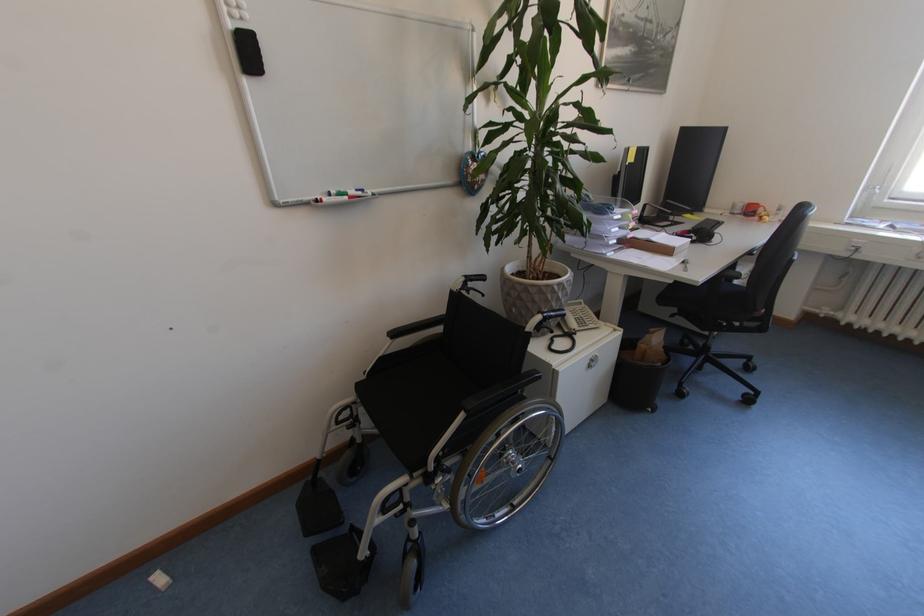
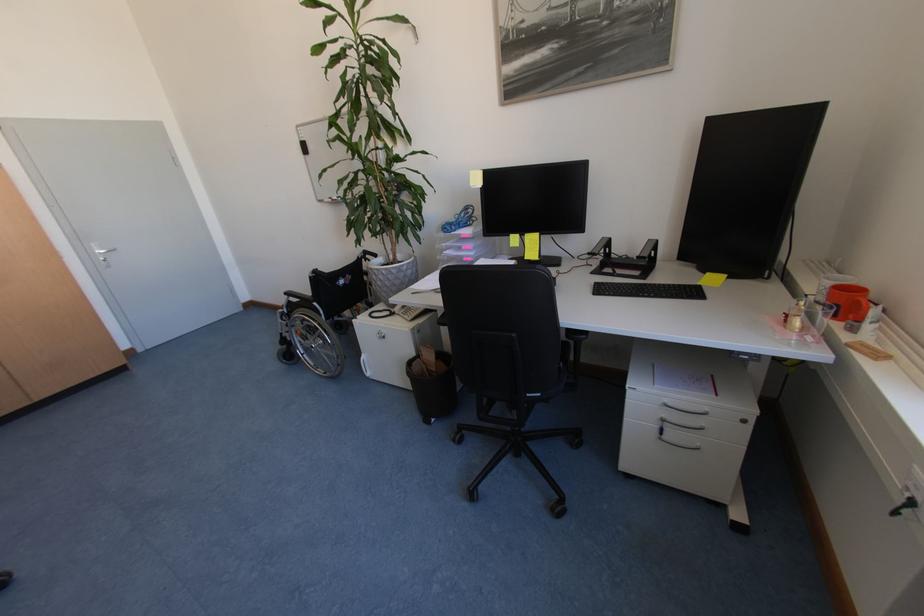
The point at (x=744, y=214) is marked in the first image. Where is the corresponding point in the second image?

(824, 300)